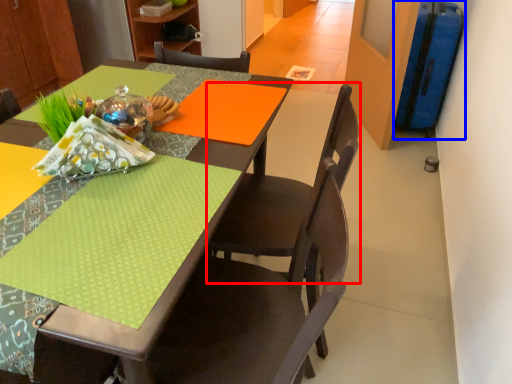
Question: Among these objects, which one is nearest to the camera, chair (highlighted by a red box) or luggage (highlighted by a blue box)?

Choices:
 (A) chair
 (B) luggage

Answer: (A)